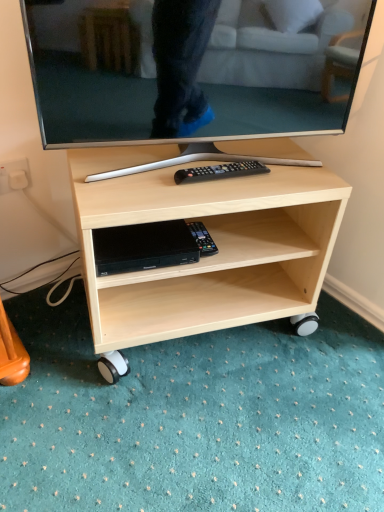
Question: Considering the relative sizes of matte black tv at center and black plastic dvd player at lower center in the image provided, is matte black tv at center bigger than black plastic dvd player at lower center?

Choices:
 (A) yes
 (B) no

Answer: (A)

Question: Would you say matte black tv at center is outside black plastic dvd player at lower center?

Choices:
 (A) yes
 (B) no

Answer: (A)

Question: Can you confirm if matte black tv at center is positioned to the left of black plastic dvd player at lower center?

Choices:
 (A) no
 (B) yes

Answer: (A)

Question: From a real-world perspective, is matte black tv at center under black plastic dvd player at lower center?

Choices:
 (A) yes
 (B) no

Answer: (B)

Question: From a real-world perspective, is matte black tv at center over black plastic dvd player at lower center?

Choices:
 (A) no
 (B) yes

Answer: (B)

Question: Is matte black tv at center shorter than black plastic dvd player at lower center?

Choices:
 (A) no
 (B) yes

Answer: (A)

Question: Can black plastic remote control at center be found inside black plastic remote at center?

Choices:
 (A) yes
 (B) no

Answer: (B)

Question: Is black plastic remote at center positioned beyond the bounds of black plastic remote control at center?

Choices:
 (A) no
 (B) yes

Answer: (B)

Question: Are black plastic remote at center and black plastic remote control at center located far from each other?

Choices:
 (A) yes
 (B) no

Answer: (B)

Question: Is black plastic remote at center behind black plastic remote control at center?

Choices:
 (A) yes
 (B) no

Answer: (B)

Question: From a real-world perspective, is black plastic remote at center under black plastic remote control at center?

Choices:
 (A) yes
 (B) no

Answer: (B)

Question: Is black plastic remote at center next to black plastic remote control at center and touching it?

Choices:
 (A) no
 (B) yes

Answer: (A)

Question: Is black plastic dvd player at lower center shorter than matte black tv at center?

Choices:
 (A) yes
 (B) no

Answer: (A)